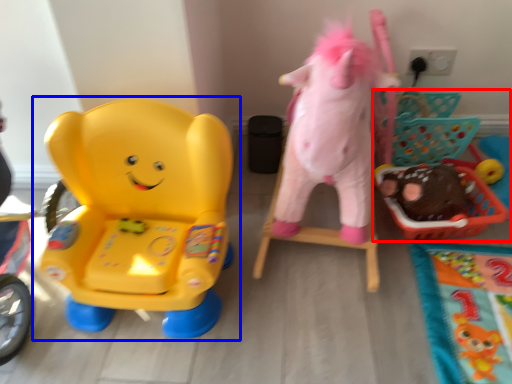
Question: Which object is closer to the camera taking this photo, toy (highlighted by a red box) or toy (highlighted by a blue box)?

Choices:
 (A) toy
 (B) toy

Answer: (B)